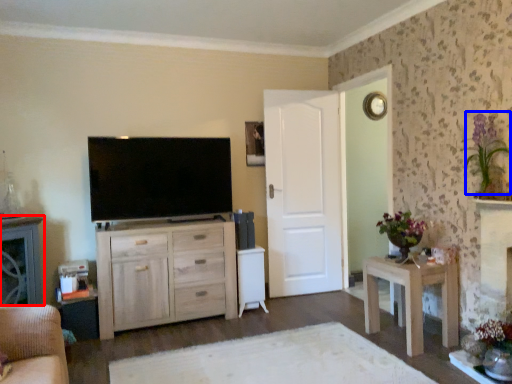
Question: Which point is closer to the camera, cabinetry (highlighted by a red box) or floral arrangement (highlighted by a blue box)?

Choices:
 (A) cabinetry
 (B) floral arrangement

Answer: (B)